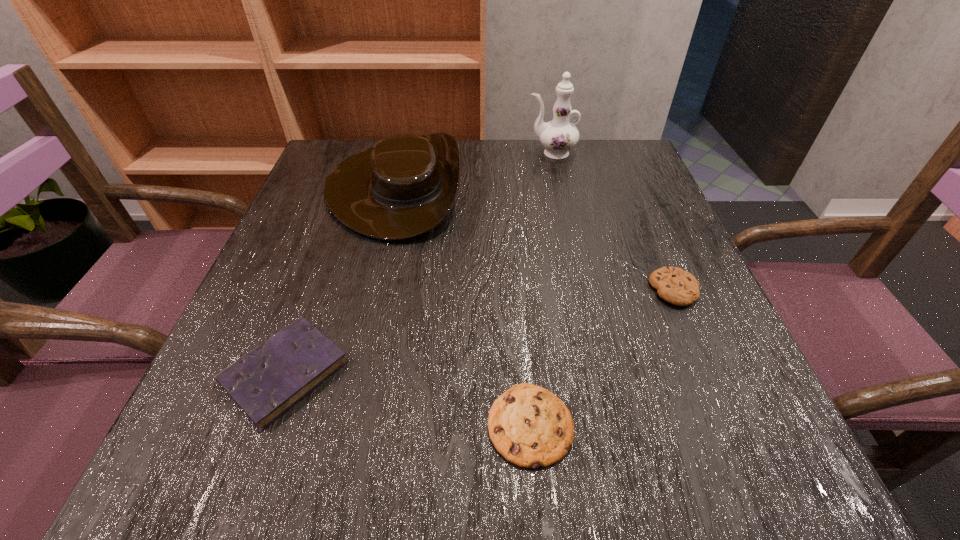
You are a GUI agent. You are given a task and a screenshot of the screen. Output one action in this format:
    pyautogui.click(x=<x>, y=<y>)
    Task: Click on the tallest object
    The image size is (960, 540).
    Given the screenshot: What is the action you would take?
    pyautogui.click(x=558, y=136)

Identify the location of the fourth shortest object. This screenshot has width=960, height=540. (403, 187).

This screenshot has width=960, height=540. Find the location of `the farther cookie`. the farther cookie is located at coordinates (676, 286).

Where is `the third farthest object`? the third farthest object is located at coordinates (676, 286).

Find the location of `diary`. diary is located at coordinates (266, 382).

The image size is (960, 540). Identify the location of the shorter cookie. (529, 426).

The height and width of the screenshot is (540, 960). I want to click on the left cookie, so click(x=529, y=426).

This screenshot has height=540, width=960. What are the coordinates of `free space located 0.350m at the spout of the tallest object` in the screenshot? It's located at (386, 153).

Image resolution: width=960 pixels, height=540 pixels. In order to click on vacant space located 0.080m at the spout of the tallest object in this screenshot , I will do `click(494, 153)`.

I want to click on vacant area situated 0.120m at the spout of the tallest object, so click(x=478, y=153).